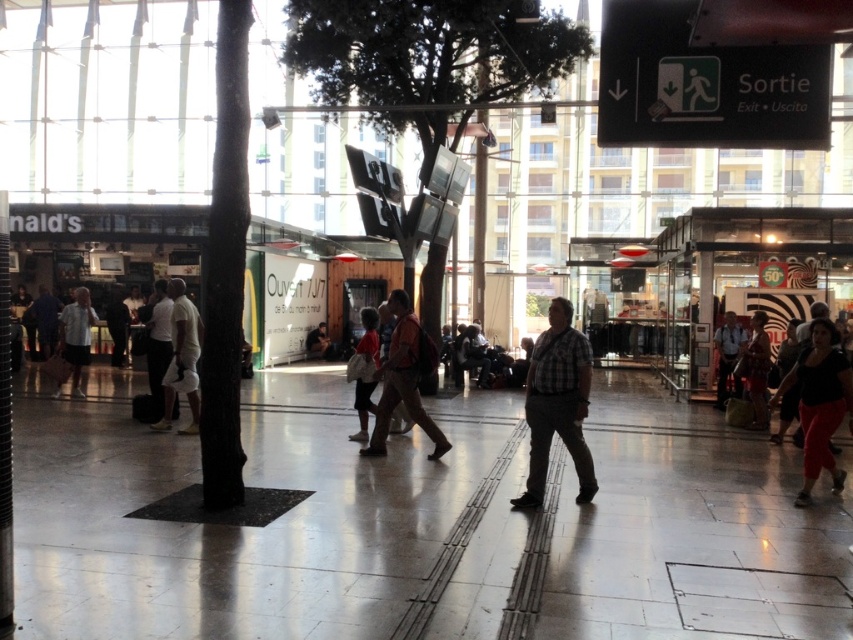
You are standing in the shopping area and want to go to the point that is closer to you. Which point should you head towards, point (184, 426) or point (48, 355)?

You should head towards point (184, 426) because it is closer to the viewer than point (48, 355).

You are standing at the entrance of the shopping area and want to find the white matte shorts at center. According to the coordinates provided, in which direction should you look to locate them?

The white matte shorts at center is located at coordinates point (181, 358), which means it is positioned slightly to the right and above the center of the image. You should look towards the upper right direction from the center to find them.